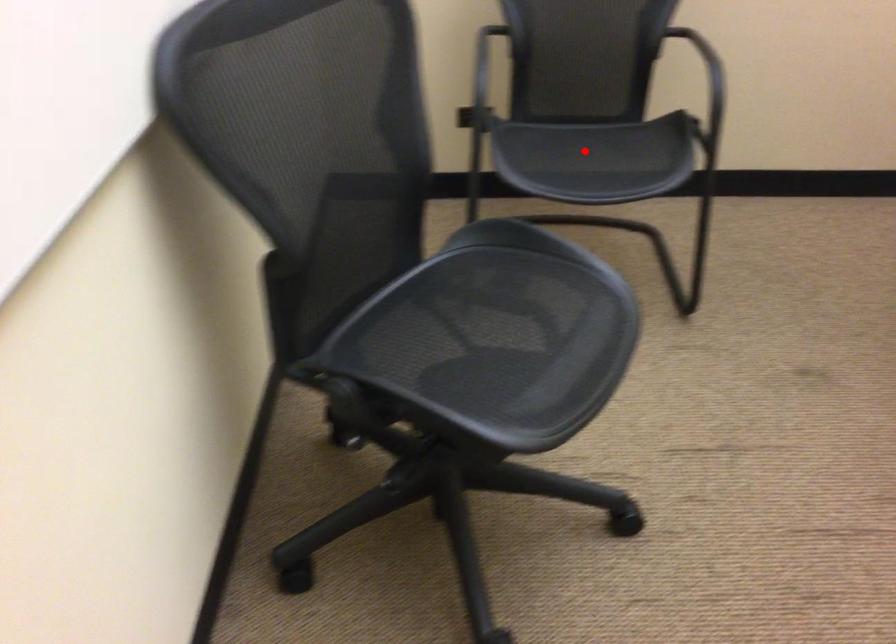
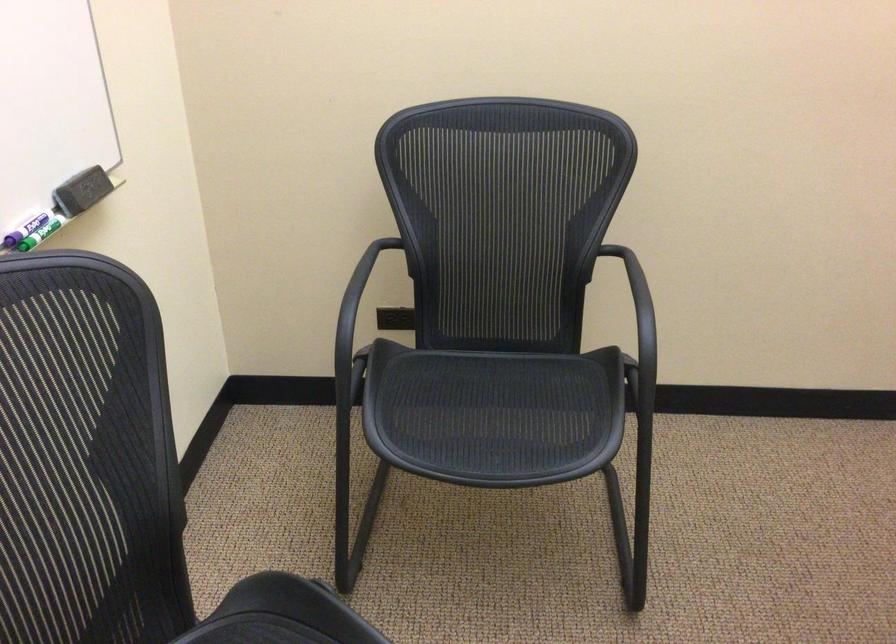
Find the pixel in the second image that matches the highlighted location in the first image.

(478, 413)